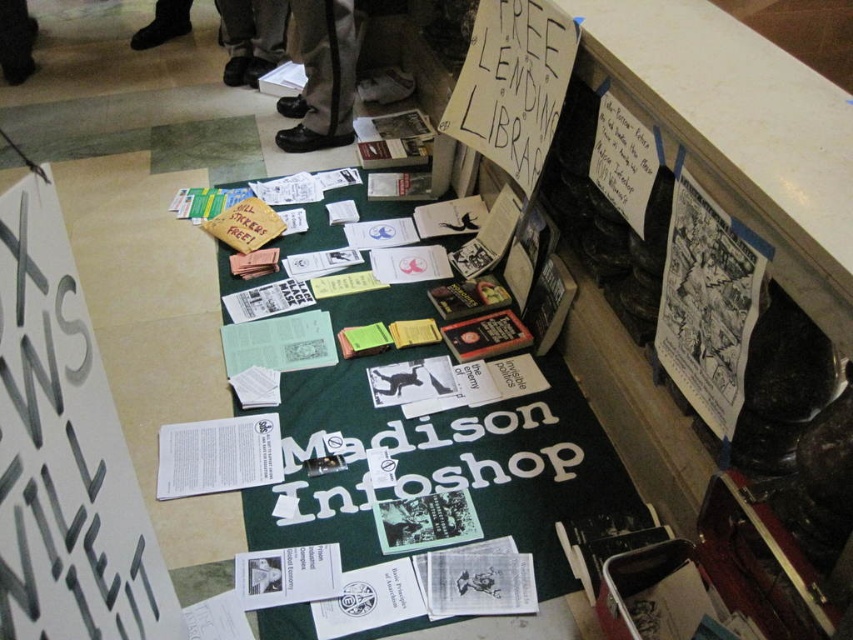
Question: Is black leather shoes at upper center wider than brown leather shoes at upper center?

Choices:
 (A) no
 (B) yes

Answer: (A)

Question: Observing the image, what is the correct spatial positioning of green paper at center in reference to black leather shoes at upper center?

Choices:
 (A) below
 (B) above

Answer: (A)

Question: Which object appears closest to the camera in this image?

Choices:
 (A) brown leather shoes at upper center
 (B) black leather shoes at upper center
 (C) white paper at lower left
 (D) green paper at center

Answer: (C)

Question: Among these points, which one is farthest from the camera?

Choices:
 (A) (25, 500)
 (B) (561, 490)
 (C) (335, 140)

Answer: (C)

Question: Which point appears closest to the camera in this image?

Choices:
 (A) (15, 218)
 (B) (512, 490)

Answer: (A)

Question: Does black leather shoes at upper center lie in front of brown leather shoes at upper center?

Choices:
 (A) no
 (B) yes

Answer: (B)